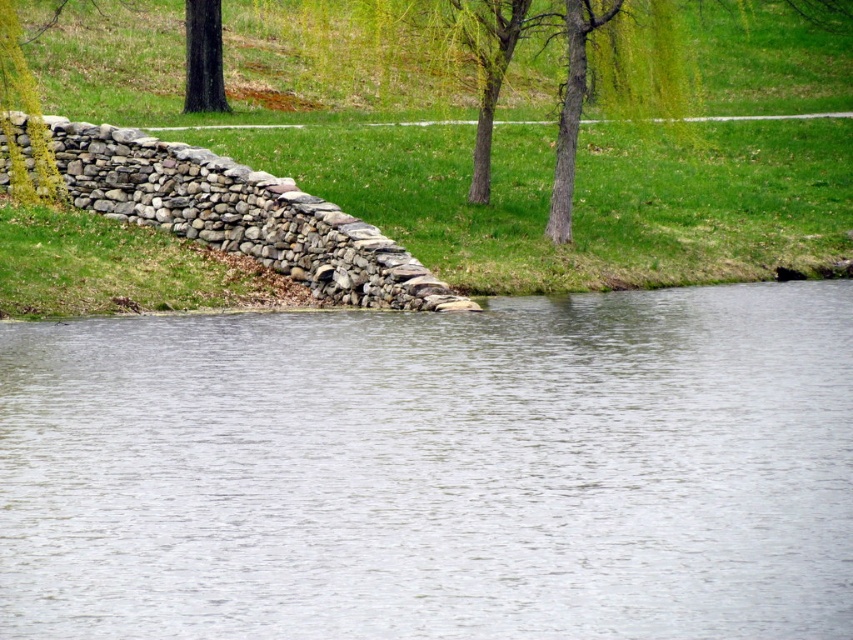
Can you confirm if clear water at center is shorter than dark brown bark tree at upper left?

Correct, clear water at center is not as tall as dark brown bark tree at upper left.

Does point (332, 593) lie in front of point (216, 28)?

Yes, point (332, 593) is closer to viewer.

Where is `clear water at center`? clear water at center is located at coordinates (434, 470).

Can you confirm if green grass at upper center is shorter than dark brown bark tree at upper left?

No.

Is point (515, 52) in front of point (202, 74)?

No, (515, 52) is behind (202, 74).

Locate an element on the screen. green grass at upper center is located at coordinates (585, 180).

The image size is (853, 640). What are the coordinates of `clear water at center` in the screenshot? It's located at (434, 470).

Is clear water at center positioned behind green grass at upper center?

No, it is in front of green grass at upper center.

This screenshot has width=853, height=640. Identify the location of clear water at center. (434, 470).